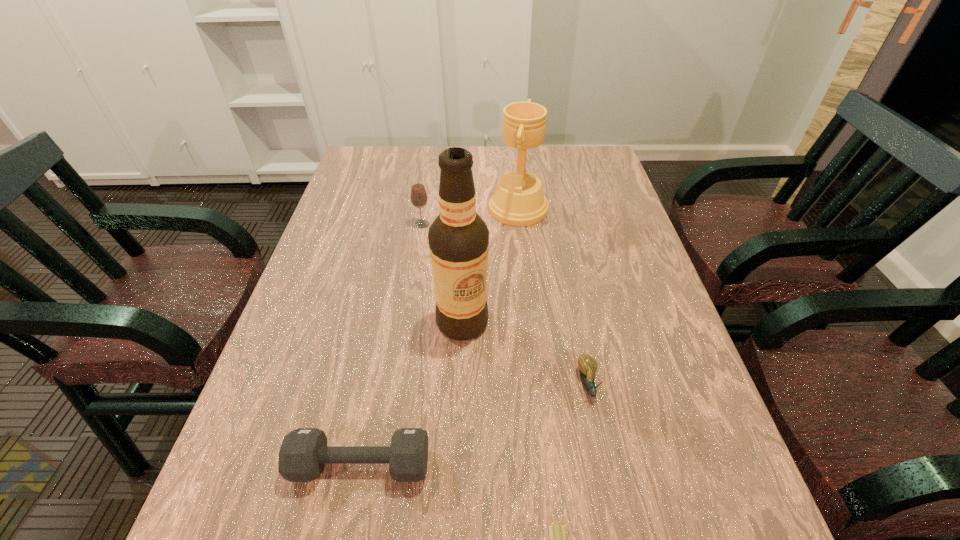
Identify the location of vacant area between the alcohol and the second tallest object. This screenshot has width=960, height=540. (491, 265).

This screenshot has width=960, height=540. Identify the location of vacant region between the glass drink container and the third nearest object. (505, 304).

Where is `free space between the glass drink container and the fourth tallest object`? This screenshot has height=540, width=960. free space between the glass drink container and the fourth tallest object is located at coordinates (392, 345).

Find the location of a particular element. empty location between the third shortest object and the farther escargot is located at coordinates (474, 424).

This screenshot has height=540, width=960. Find the location of `free space between the third farthest object and the award`. free space between the third farthest object and the award is located at coordinates (491, 265).

This screenshot has height=540, width=960. Identify the location of blank region between the right escargot and the fourth shortest object. (505, 304).

The image size is (960, 540). What are the coordinates of `object that is the fourth closest to the award` in the screenshot? It's located at (304, 452).

Locate an element on the screen. The image size is (960, 540). the fourth closest object to the fourth shortest object is located at coordinates tap(304, 452).